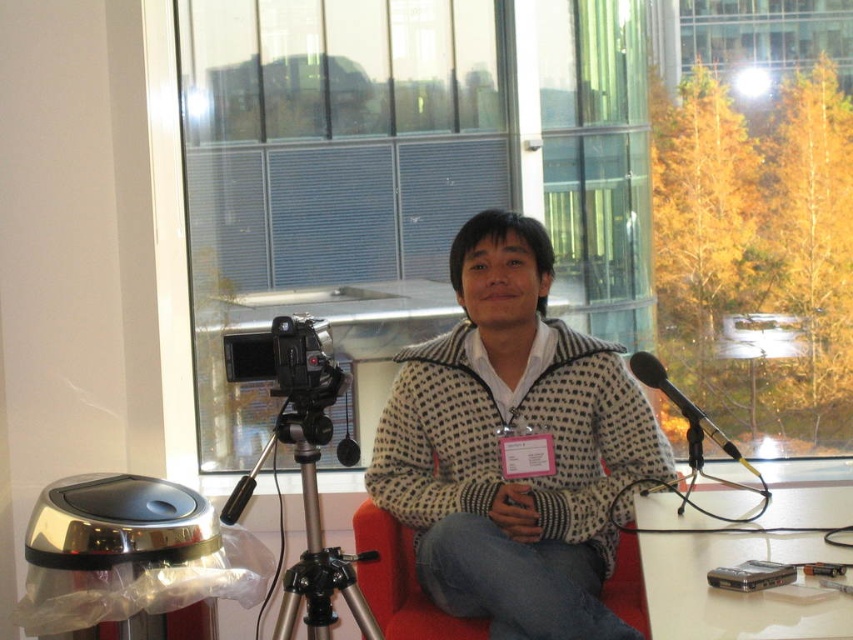
You are setting up a camera for a video call. You have a red fabric armchair at center and a metallic silver microphone at right. Which object is taller?

The red fabric armchair at center is much taller than the metallic silver microphone at right.

You are setting up a video call in a room with a silver metallic tripod at lower left and a metallic silver microphone at right. You need to place a laptop between them. Can the laptop fit if it measures 12 inches in width?

The distance between the silver metallic tripod at lower left and the metallic silver microphone at right is 26.68 inches. Since the laptop is 12 inches wide, there is enough space to place it between them.

You are setting up for a presentation and need to place a laptop between the silver metallic tripod at lower left and the metallic silver microphone at right. Can the laptop fit between them if the laptop is 30 cm wide?

The silver metallic tripod at lower left is wider than the metallic silver microphone at right. Since the tripod is wider, the space between them might be sufficient. However, without knowing the exact distance between the two objects, we cannot definitively confirm if the laptop will fit. Please measure the gap before placing the laptop.